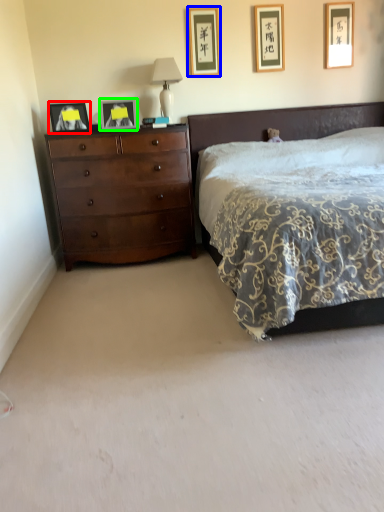
Question: Based on their relative distances, which object is farther from picture frame (highlighted by a red box)? Choose from picture frame (highlighted by a blue box) and picture frame (highlighted by a green box).

Choices:
 (A) picture frame
 (B) picture frame

Answer: (A)